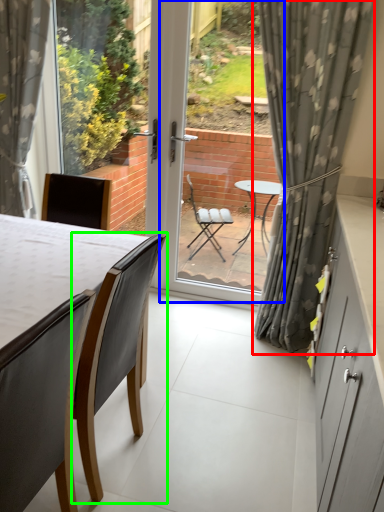
Question: Which is nearer to the curtain (highlighted by a red box)? glass door (highlighted by a blue box) or chair (highlighted by a green box).

Choices:
 (A) glass door
 (B) chair

Answer: (B)